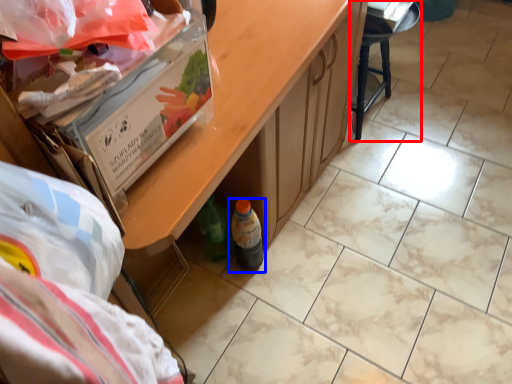
Question: Among these objects, which one is nearest to the camera, furniture (highlighted by a red box) or bottle (highlighted by a blue box)?

Choices:
 (A) furniture
 (B) bottle

Answer: (B)